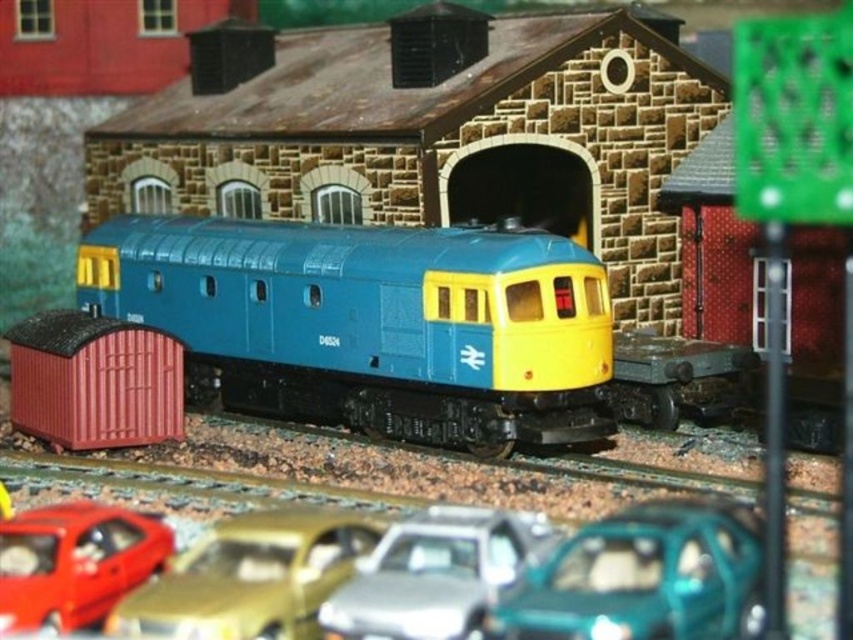
You are a toy car collector who wants to arrange your cars in a straight line from left to right. You have a metallic silver car at center and a shiny red car at lower left. Based on the scene, which car should be placed first on the left side of the line?

The shiny red car at lower left should be placed first on the left side of the line because the metallic silver car at center is to the right of it in the scene.

You are a model railway enthusiast who wants to place a new miniature car next to the gold metallic car at lower center and the matte plastic container at lower left. Which object should you place it next to if you want the new car to be wider than both existing objects?

The gold metallic car at lower center has a lesser width compared to matte plastic container at lower left, so you should place the new car next to the matte plastic container at lower left since it is wider than the gold metallic car at lower center.

You are a model railway enthusiast examining the scene. You notice the gold metallic car at lower center and the matte plastic container at lower left. Which object would require less space to place on a shelf if you wanted to display them separately?

The gold metallic car at lower center has a smaller size compared to the matte plastic container at lower left, so it would require less space to display separately.